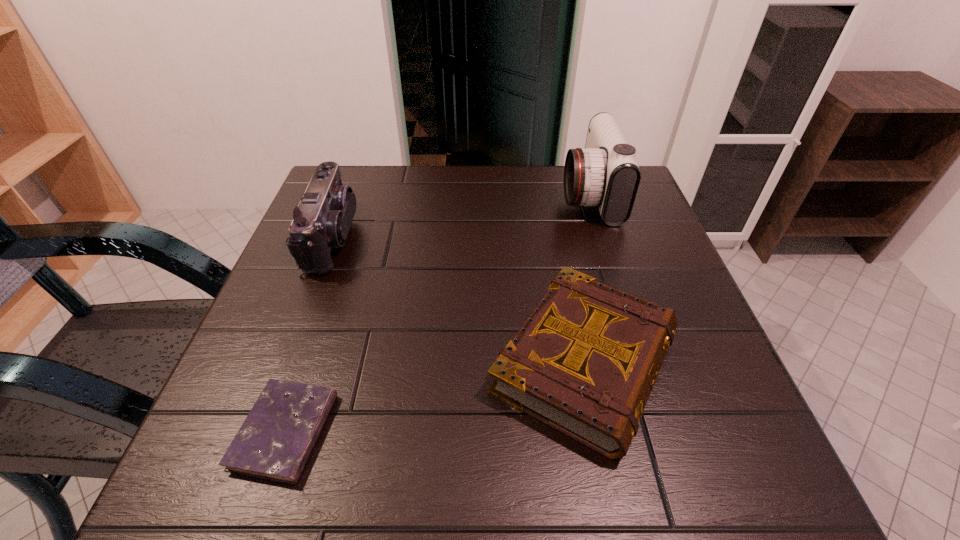
Image resolution: width=960 pixels, height=540 pixels. I want to click on vacant space that satisfies the following two spatial constraints: 1. on the front-facing side of the hardback book; 2. on the right side of the shorter camcorder, so [284, 362].

Identify the location of vacant space that satisfies the following two spatial constraints: 1. on the front-facing side of the hardback book; 2. on the right side of the second tallest object. (284, 362).

Find the location of a particular element. The width and height of the screenshot is (960, 540). blank space that satisfies the following two spatial constraints: 1. on the back side of the diary; 2. on the front-facing side of the second tallest object is located at coordinates (350, 237).

This screenshot has height=540, width=960. Find the location of `vacant space that satisfies the following two spatial constraints: 1. on the front-facing side of the left camcorder; 2. on the right side of the third tallest object`. vacant space that satisfies the following two spatial constraints: 1. on the front-facing side of the left camcorder; 2. on the right side of the third tallest object is located at coordinates (284, 362).

You are a GUI agent. You are given a task and a screenshot of the screen. Output one action in this format:
    pyautogui.click(x=<x>, y=<y>)
    Task: Click on the vacant space that satisfies the following two spatial constraints: 1. on the surface of the tallest object; 2. on the front side of the shortest object
    
    Given the screenshot: What is the action you would take?
    pyautogui.click(x=663, y=431)

Where is `blank area in the image that satisfies the following two spatial constraints: 1. on the front-facing side of the left camcorder; 2. on the left side of the hardback book`? blank area in the image that satisfies the following two spatial constraints: 1. on the front-facing side of the left camcorder; 2. on the left side of the hardback book is located at coordinates (284, 362).

Where is `free location that satisfies the following two spatial constraints: 1. on the front-facing side of the third shortest object; 2. on the right side of the diary`? The height and width of the screenshot is (540, 960). free location that satisfies the following two spatial constraints: 1. on the front-facing side of the third shortest object; 2. on the right side of the diary is located at coordinates (258, 431).

Where is `free space that satisfies the following two spatial constraints: 1. on the front-facing side of the diary; 2. on the left side of the second tallest object`? free space that satisfies the following two spatial constraints: 1. on the front-facing side of the diary; 2. on the left side of the second tallest object is located at coordinates (258, 431).